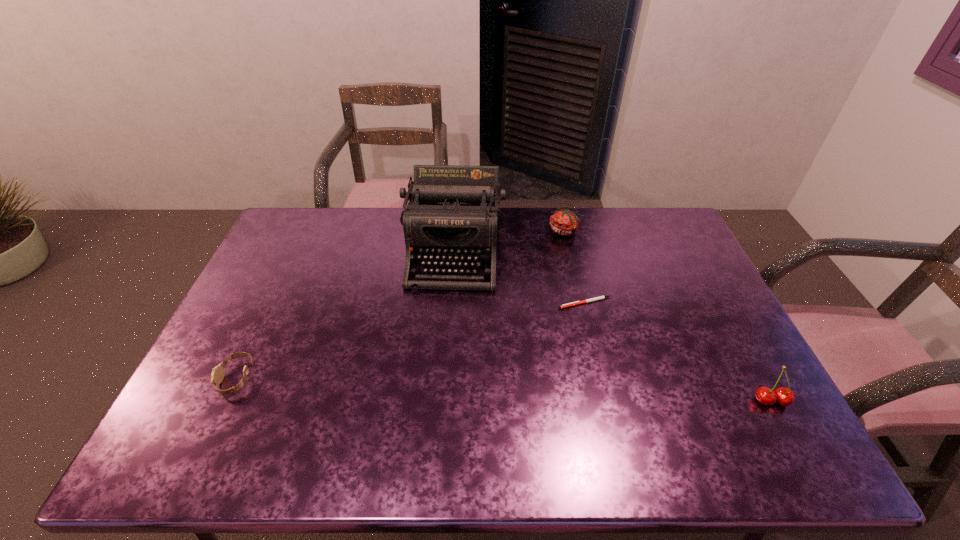
In the image, there is a desktop. Identify the location of vacant space at the far left corner. The image size is (960, 540). (329, 210).

What are the coordinates of `blank space at the far right corner` in the screenshot? It's located at (670, 225).

The image size is (960, 540). Identify the location of empty location between the third tallest object and the watch. (400, 305).

Locate an element on the screen. The width and height of the screenshot is (960, 540). vacant region between the tomato and the watch is located at coordinates (400, 305).

Locate an element on the screen. This screenshot has width=960, height=540. vacant space that is in between the leftmost object and the second object from left to right is located at coordinates (346, 314).

In order to click on vacant space in between the watch and the second tallest object in this screenshot , I will do `click(504, 389)`.

At what (x,y) coordinates should I click in order to perform the action: click on vacant area that lies between the pen and the tomato. Please return your answer as a coordinate pair (x, y). Looking at the image, I should click on (575, 267).

Find the location of a particular element. unoccupied area between the typewriter and the fourth shortest object is located at coordinates tap(612, 326).

In order to click on unoccupied area between the fourth tallest object and the tomato in this screenshot , I will do `click(400, 305)`.

Find the location of `vacant space in between the leftmost object and the tomato`. vacant space in between the leftmost object and the tomato is located at coordinates (400, 305).